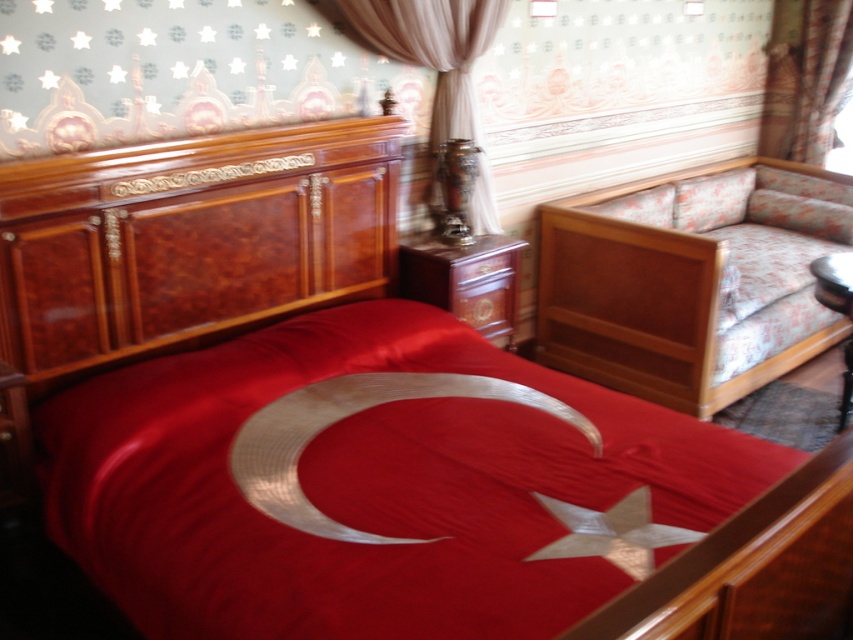
Question: Which point appears closest to the camera in this image?

Choices:
 (A) (28, 301)
 (B) (384, 20)
 (C) (807, 44)
 (D) (796, 173)

Answer: (A)

Question: Which of the following is the closest to the observer?

Choices:
 (A) sheer beige curtain at center
 (B) satin curtain at upper right
 (C) wooden bed frame at right
 (D) burlwood headboard at left

Answer: (D)

Question: Can you confirm if burlwood headboard at left is smaller than wooden bed frame at right?

Choices:
 (A) no
 (B) yes

Answer: (B)

Question: Is sheer beige curtain at center thinner than satin curtain at upper right?

Choices:
 (A) no
 (B) yes

Answer: (A)

Question: Is burlwood headboard at left to the right of wooden bed frame at right from the viewer's perspective?

Choices:
 (A) no
 (B) yes

Answer: (A)

Question: Which of the following is the closest to the observer?

Choices:
 (A) (813, 72)
 (B) (355, 156)
 (C) (352, 26)
 (D) (838, 237)

Answer: (C)